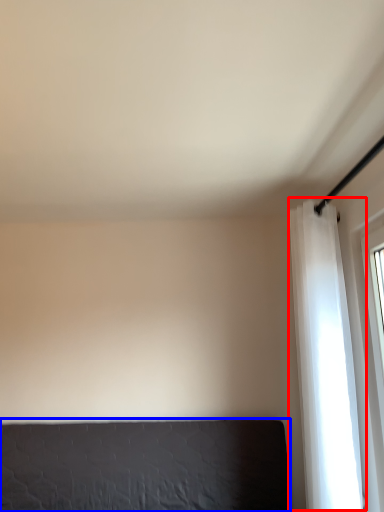
Question: Which object is further to the camera taking this photo, curtain (highlighted by a red box) or furniture (highlighted by a blue box)?

Choices:
 (A) curtain
 (B) furniture

Answer: (B)